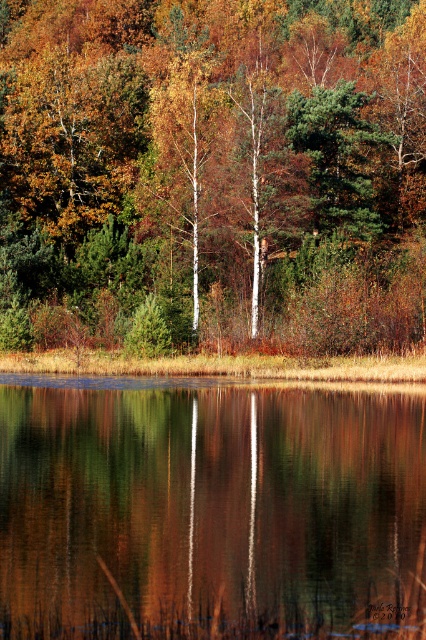
You are standing at the center of the image and want to locate the white smooth birch tree at center. Which direction should you look to find it?

The white smooth birch tree at center is located at point coordinates of 0.234 on the x axis and 0.444 on the y axis. Since you are at the center, which is point 0.5 on both axes, you should look to the left and slightly downward to find the white smooth birch tree at center.